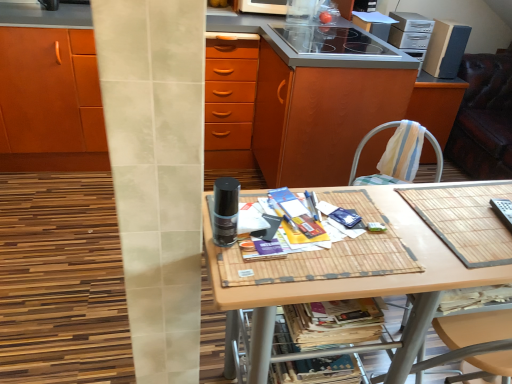
Question: Is bamboo mat at center positioned before printed paper magazine at lower center, positioned as the 2th magazine in top-to-bottom order?

Choices:
 (A) yes
 (B) no

Answer: (A)

Question: Can you confirm if bamboo mat at center is taller than printed paper magazine at lower center, arranged as the 1th magazine when ordered from the bottom?

Choices:
 (A) yes
 (B) no

Answer: (A)

Question: From the image's perspective, is bamboo mat at center located above printed paper magazine at lower center, arranged as the 1th magazine when ordered from the bottom?

Choices:
 (A) yes
 (B) no

Answer: (B)

Question: From a real-world perspective, is bamboo mat at center on printed paper magazine at lower center, positioned as the 2th magazine in top-to-bottom order?

Choices:
 (A) yes
 (B) no

Answer: (B)

Question: Does bamboo mat at center touch printed paper magazine at lower center, arranged as the 1th magazine when ordered from the bottom?

Choices:
 (A) no
 (B) yes

Answer: (A)

Question: Looking at their shapes, would you say black glass stove at upper center, which appears as the 2th appliance when viewed from the top, is wider or thinner than bamboo mat at center?

Choices:
 (A) thin
 (B) wide

Answer: (B)

Question: From their relative heights in the image, would you say black glass stove at upper center, which is the 2th appliance in bottom-to-top order, is taller or shorter than bamboo mat at center?

Choices:
 (A) tall
 (B) short

Answer: (B)

Question: Does point (375, 44) appear closer or farther from the camera than point (375, 281)?

Choices:
 (A) closer
 (B) farther

Answer: (B)

Question: Visually, is black glass stove at upper center, marked as the second appliance in a front-to-back arrangement, positioned to the left or to the right of bamboo mat at center?

Choices:
 (A) left
 (B) right

Answer: (A)

Question: From the image's perspective, is striped fabric chair at right above or below black plastic remote control at right, the 3th appliance in the back-to-front sequence?

Choices:
 (A) below
 (B) above

Answer: (B)

Question: From a real-world perspective, is striped fabric chair at right positioned above or below black plastic remote control at right, the 1th appliance when ordered from front to back?

Choices:
 (A) below
 (B) above

Answer: (A)

Question: Looking at their shapes, would you say striped fabric chair at right is wider or thinner than black plastic remote control at right, the 3th appliance in the back-to-front sequence?

Choices:
 (A) thin
 (B) wide

Answer: (A)

Question: Considering their positions, is striped fabric chair at right located in front of or behind black plastic remote control at right, the 3th appliance in the back-to-front sequence?

Choices:
 (A) behind
 (B) front

Answer: (A)

Question: From a real-world perspective, is matte wood cabinet at center above or below black glass stove at upper center, which appears as the 2th appliance when viewed from the top?

Choices:
 (A) below
 (B) above

Answer: (A)

Question: Considering the positions of matte wood cabinet at center and black glass stove at upper center, which is the 2th appliance in bottom-to-top order, in the image, is matte wood cabinet at center wider or thinner than black glass stove at upper center, which is the 2th appliance in bottom-to-top order,?

Choices:
 (A) thin
 (B) wide

Answer: (B)